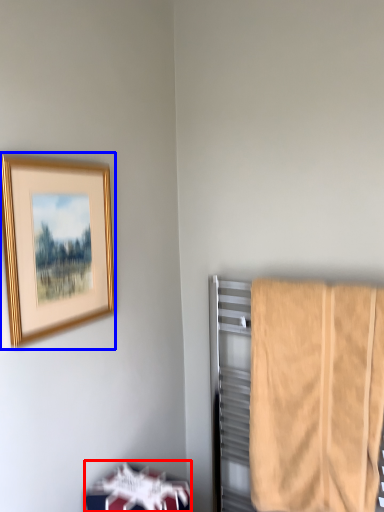
Question: Which point is closer to the camera, furniture (highlighted by a red box) or picture frame (highlighted by a blue box)?

Choices:
 (A) furniture
 (B) picture frame

Answer: (B)